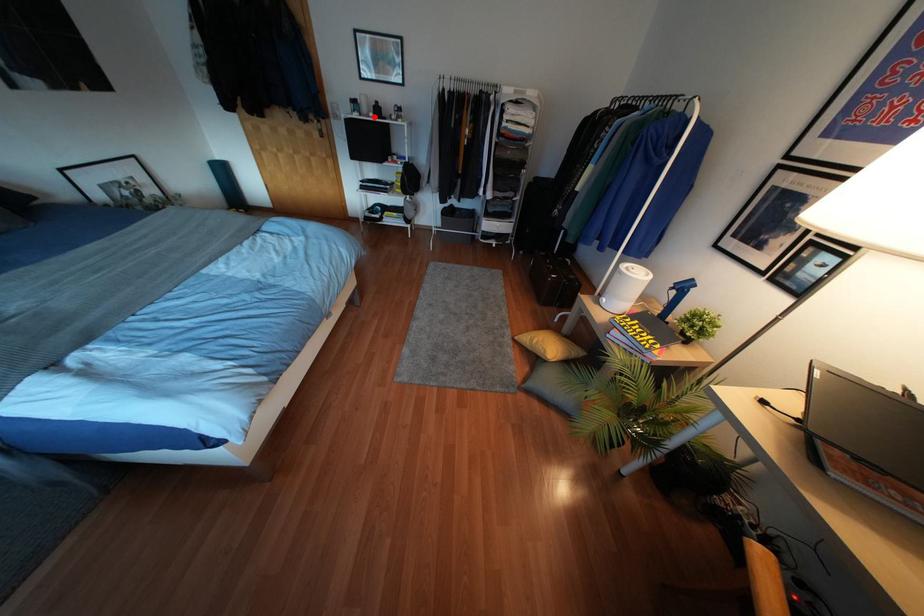
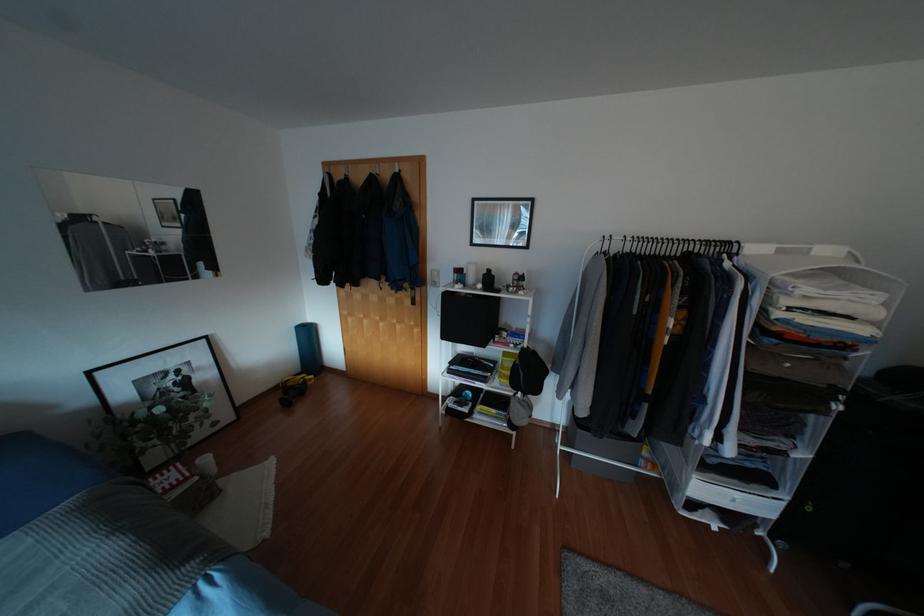
The point at the highlighted location is marked in the first image. Where is the corresponding point in the second image?

(483, 289)